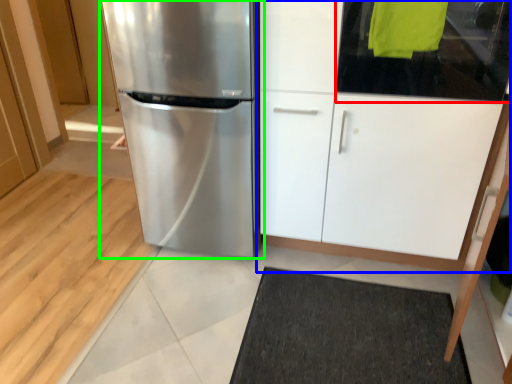
Question: Which is farther away from glass door (highlighted by a red box)? cabinetry (highlighted by a blue box) or refrigerator (highlighted by a green box)?

Choices:
 (A) cabinetry
 (B) refrigerator

Answer: (B)